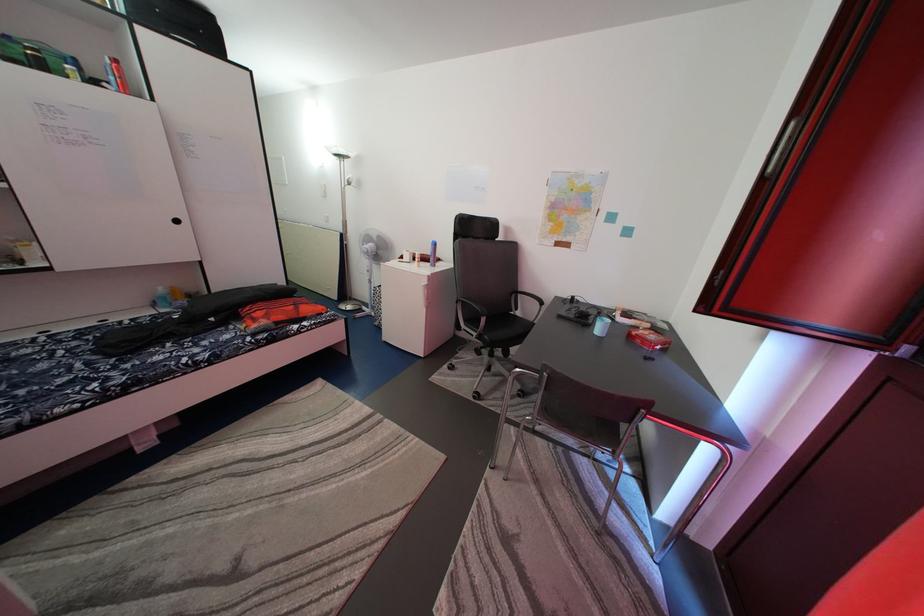
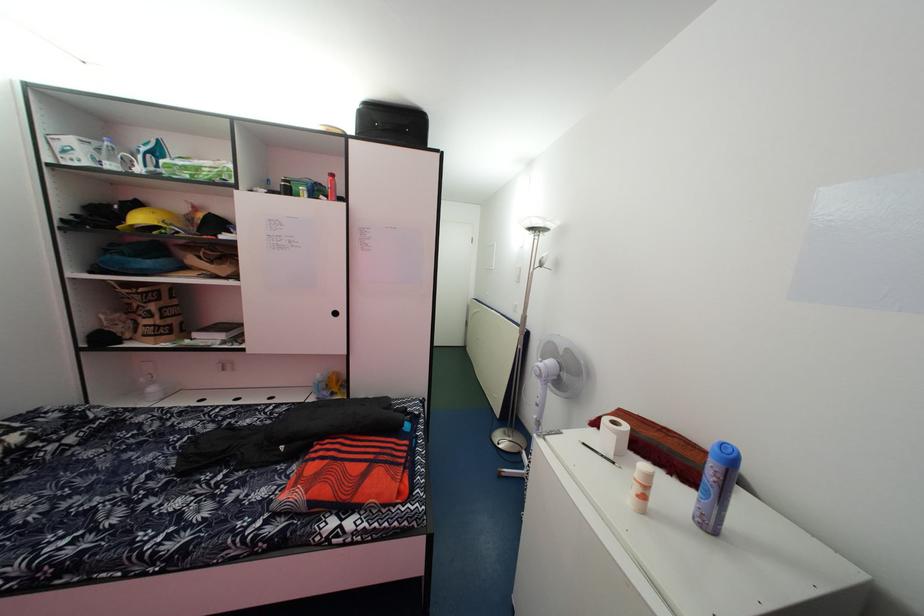
Where in the second image is the point corresponding to [444,252] from the first image?

(738, 466)